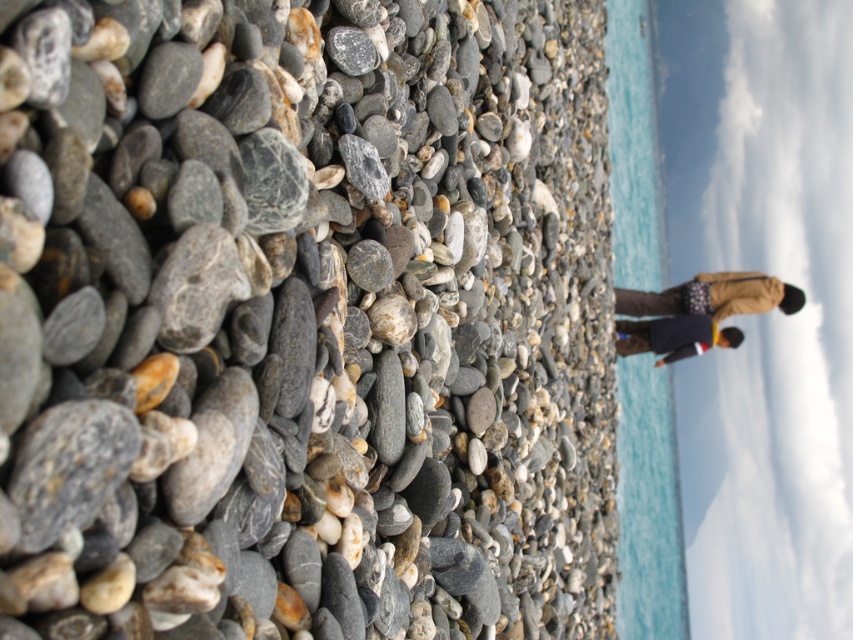
Question: Which point is closer to the camera taking this photo?

Choices:
 (A) (704, 275)
 (B) (653, 337)
 (C) (633, 522)
 (D) (230, 90)

Answer: (D)

Question: Based on their relative distances, which object is farther from the smooth gray pebble at center?

Choices:
 (A) blue water at center
 (B) clear blue water at right

Answer: (A)

Question: Is smooth gray pebble at center to the left of dark blue jacket at center from the viewer's perspective?

Choices:
 (A) yes
 (B) no

Answer: (A)

Question: Does smooth gray pebble at center appear on the left side of dark blue jacket at center?

Choices:
 (A) yes
 (B) no

Answer: (A)

Question: Based on their relative distances, which object is farther from the dark blue jacket at center?

Choices:
 (A) clear blue water at right
 (B) brown fabric jacket at right
 (C) smooth gray pebble at center
 (D) blue water at center

Answer: (C)

Question: Does clear blue water at right appear under dark blue jacket at center?

Choices:
 (A) no
 (B) yes

Answer: (A)